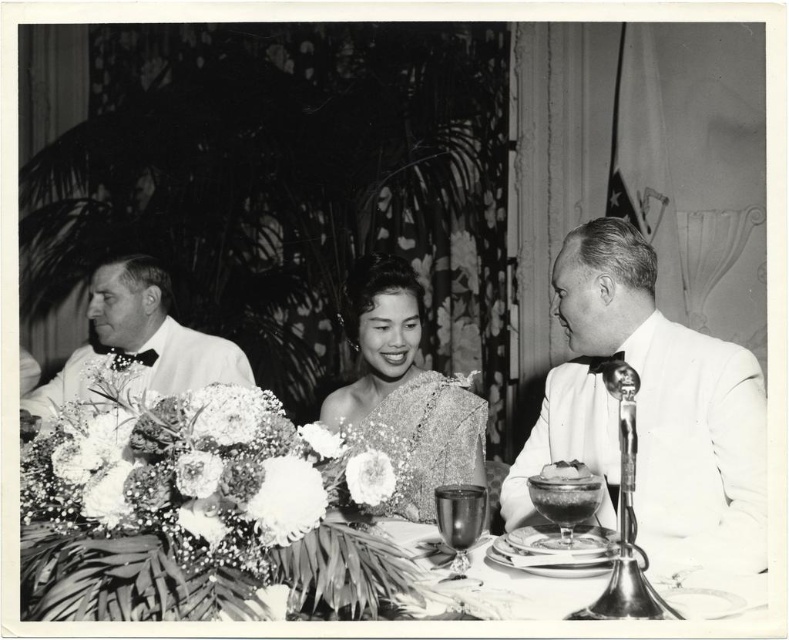
You are a photographer who wants to capture a closeup of the silky satin dress at center and the satin cake at center in the same frame. Given their sizes, which one would require you to move closer to get a detailed shot?

The silky satin dress at center is bigger than the satin cake at center, so to capture both in the same frame with detail, you would need to move closer to the satin cake at center since it is smaller.

You are a photographer adjusting your camera settings for the dining scene. You notice two points marked in the image at coordinates point (742, 397) and point (589, 476). Which point is closer to your camera lens?

Point (742, 397) is further to the camera than point (589, 476), so the point closer to the camera lens is point (589, 476).